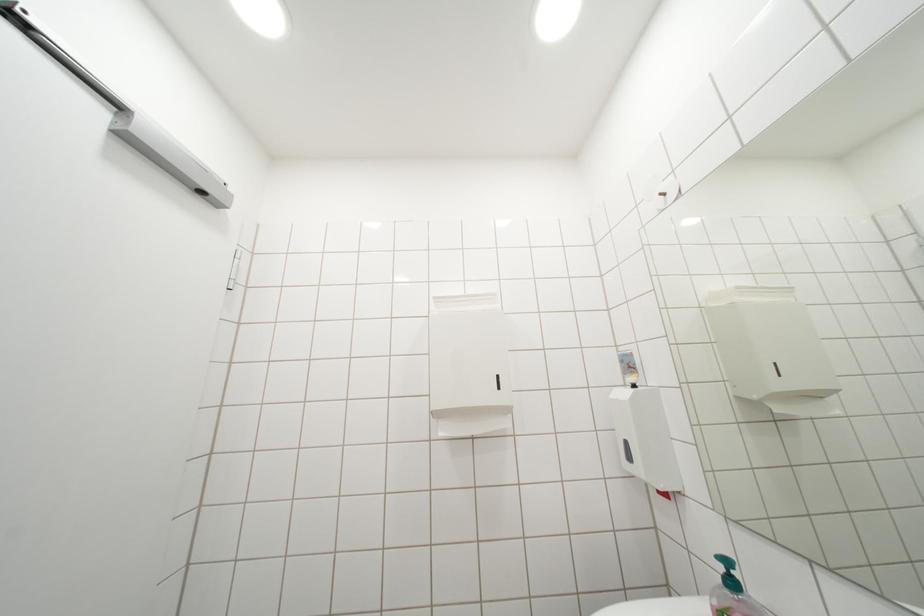
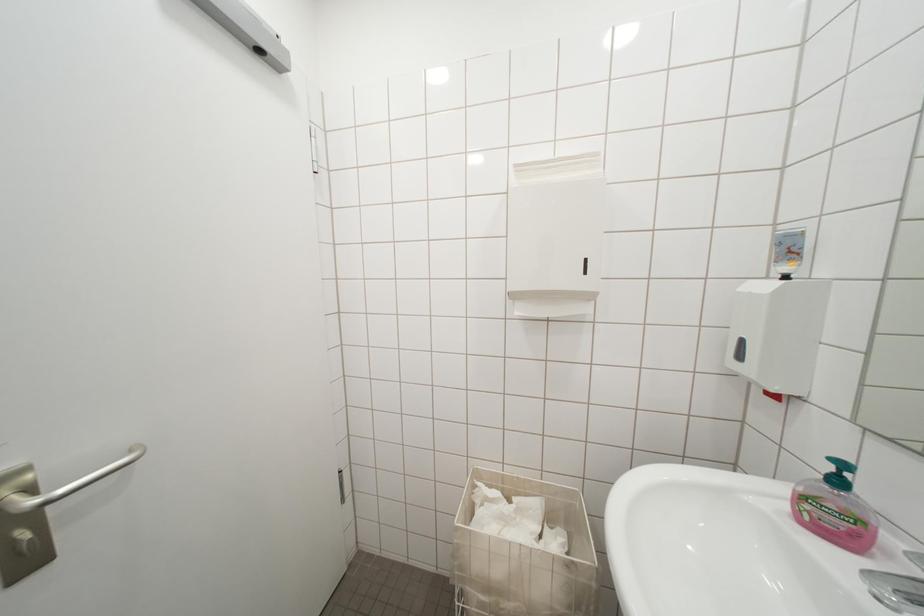
What movement of the cameraman would produce the second image?

The movement direction of the cameraman is left, forward.